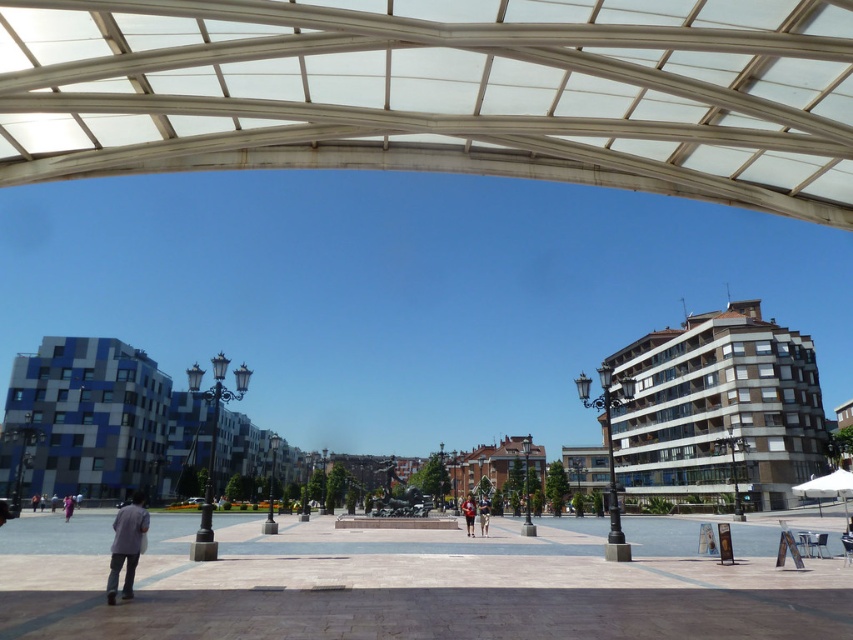
You are standing in the plaza and want to take a photo of the light blue denim jeans at lower left without any obstructions. Is the white fabric canopy at lower right blocking your view?

The white fabric canopy at lower right is above the light blue denim jeans at lower left, so it may block your view depending on your angle. To avoid obstruction, position yourself lower or move to the side where the canopy is not directly overhead.